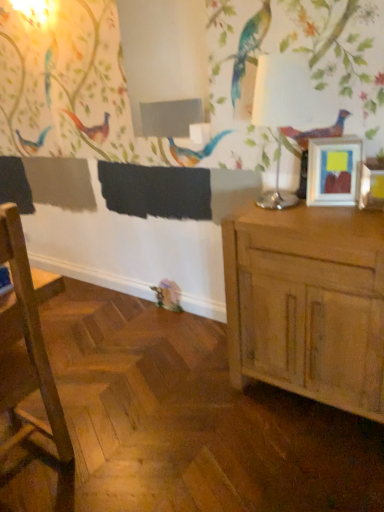
Question: Considering their positions, is wooden chair at left located in front of or behind light brown wood cabinet at right?

Choices:
 (A) behind
 (B) front

Answer: (B)

Question: Would you say wooden chair at left is to the left or to the right of light brown wood cabinet at right in the picture?

Choices:
 (A) right
 (B) left

Answer: (B)

Question: Which of these objects is positioned closest to the matte silver picture frame at upper right?

Choices:
 (A) white glossy table lamp at upper right
 (B) light brown wood cabinet at right
 (C) wooden chair at left

Answer: (A)

Question: Based on their relative distances, which object is farther from the light brown wood cabinet at right?

Choices:
 (A) wooden chair at left
 (B) matte silver picture frame at upper right
 (C) white glossy table lamp at upper right

Answer: (A)